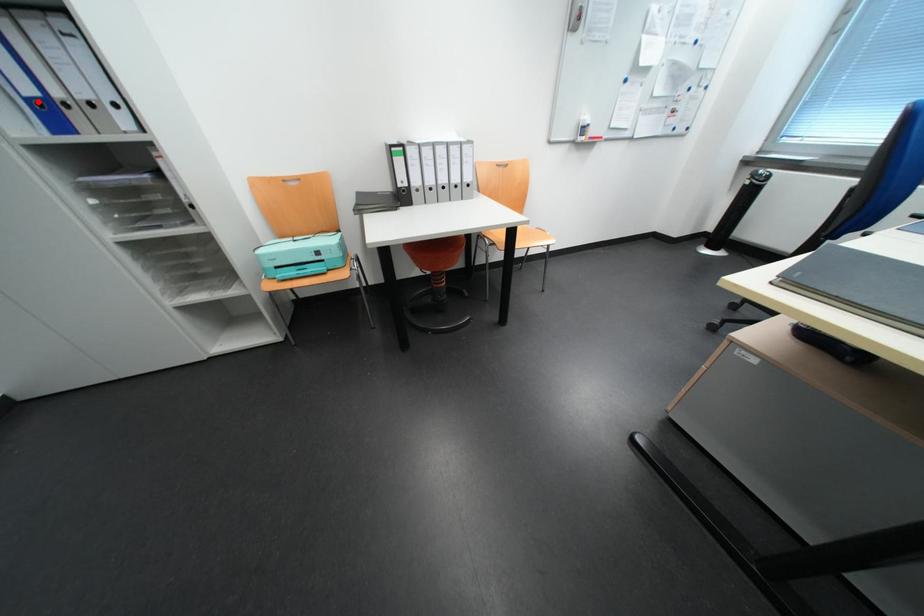
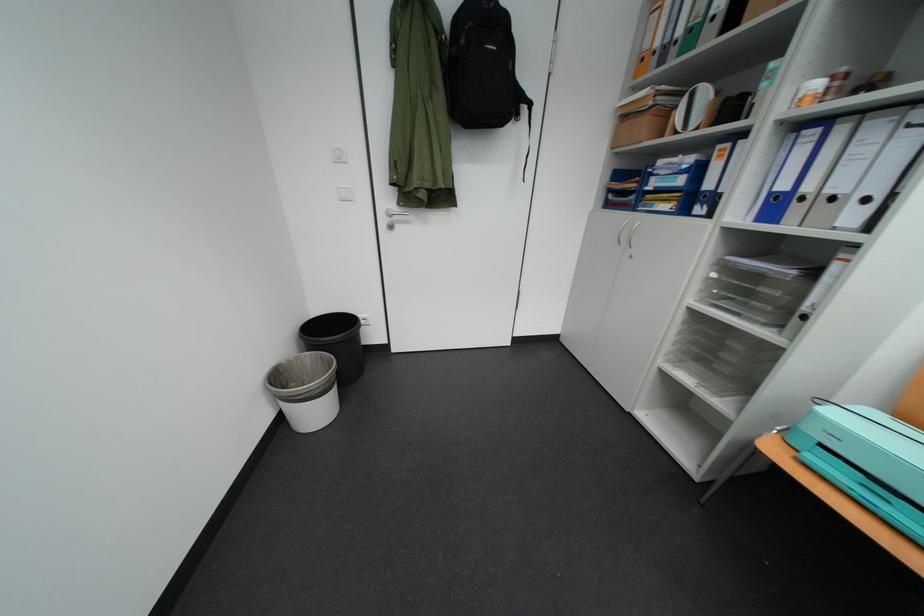
In the second image, find the point that corresponds to the highlighted location in the first image.

(782, 196)